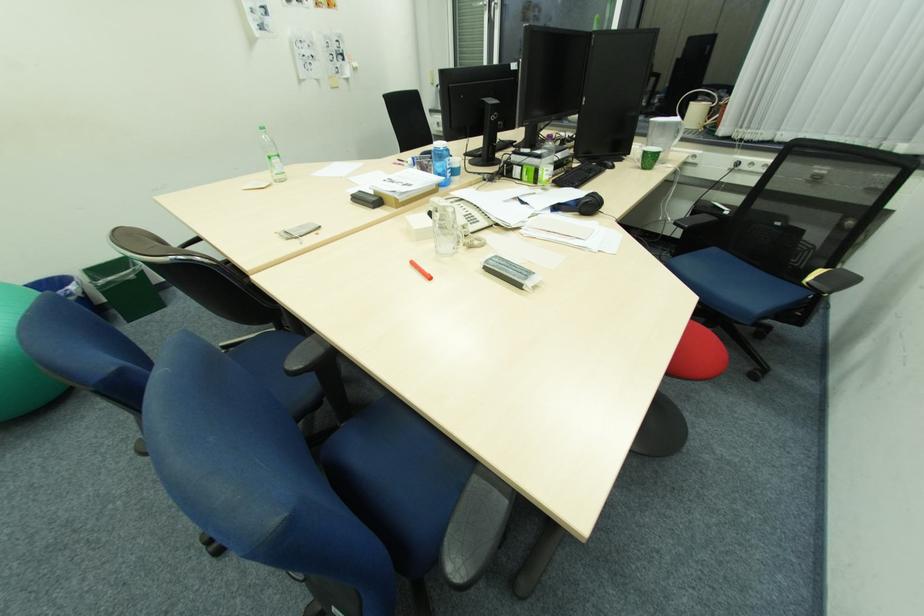
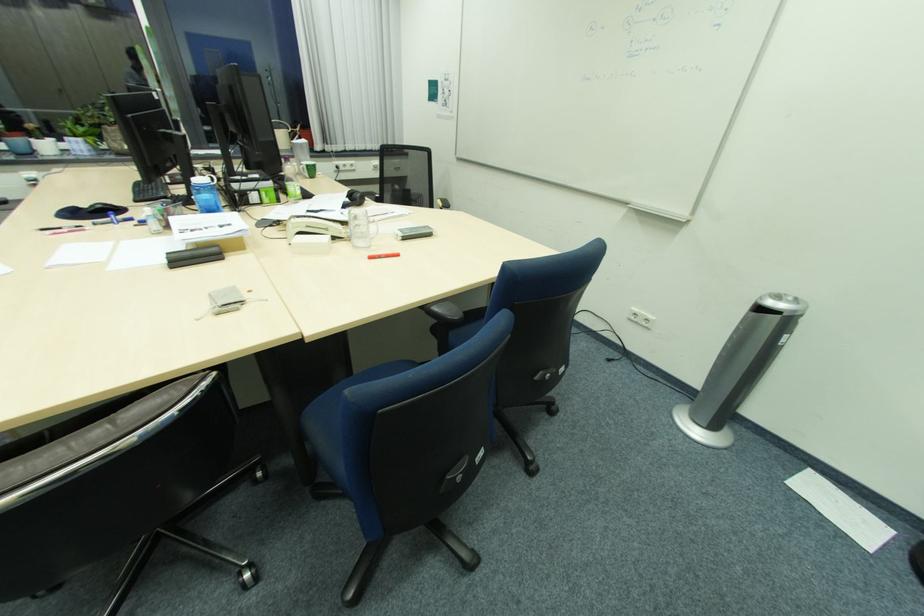
Where in the second image is the point corresponding to (366,192) from the first image?

(175, 254)